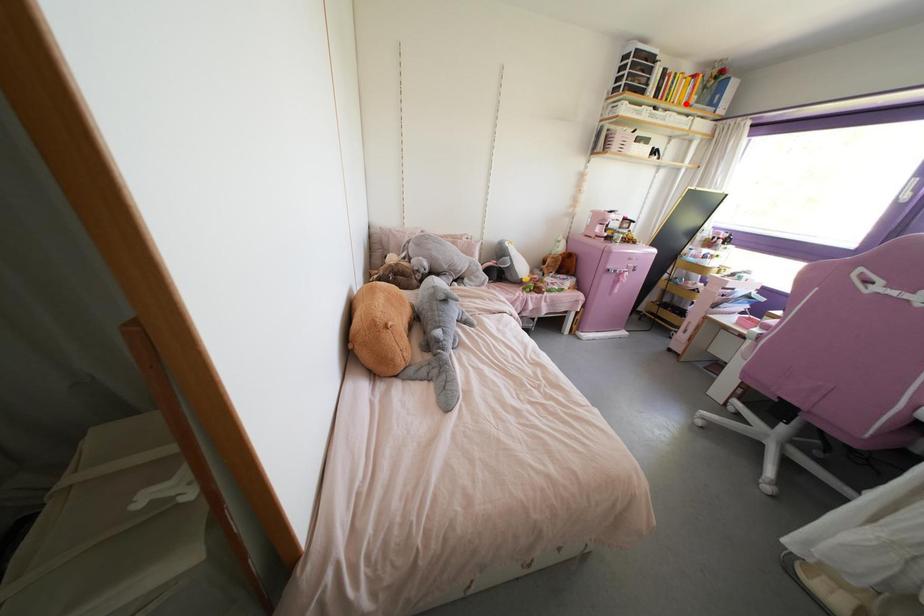
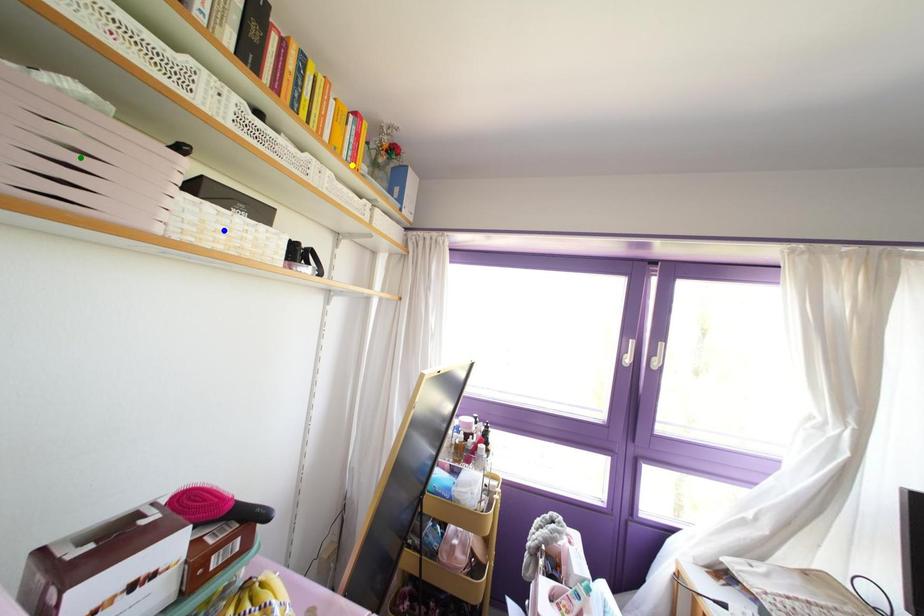
Question: I am providing you with two images of the same scene from different viewpoints. A red point is marked on the first image. You are given multiple points on the second image. Can you choose the point in image 2 that corresponds to the point in image 1?

Choices:
 (A) blue point
 (B) yellow point
 (C) green point

Answer: (B)